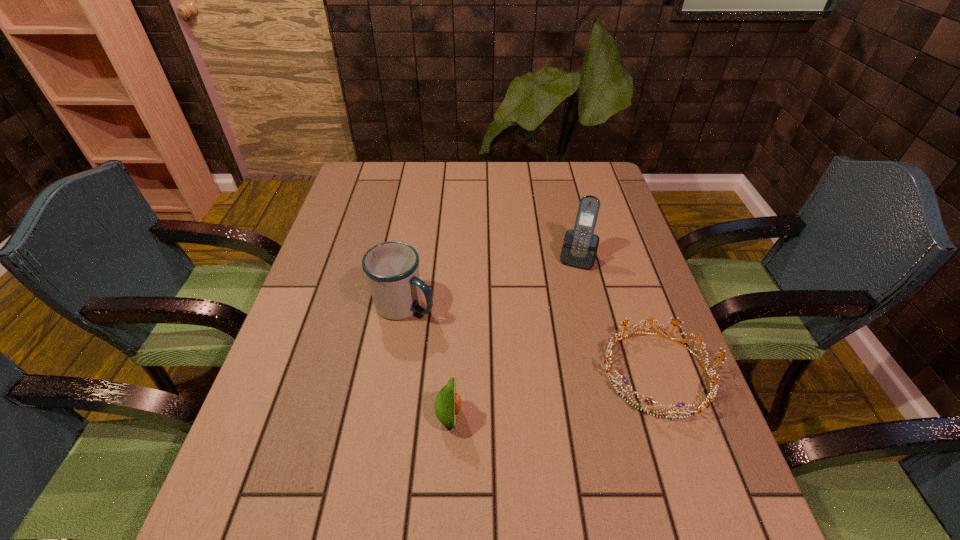
Locate an element on the screen. avocado is located at coordinates (447, 404).

Locate an element on the screen. This screenshot has width=960, height=540. the second object from left to right is located at coordinates (447, 404).

Locate an element on the screen. The height and width of the screenshot is (540, 960). the shortest object is located at coordinates (712, 392).

Locate an element on the screen. Image resolution: width=960 pixels, height=540 pixels. the leftmost object is located at coordinates (392, 268).

Locate an element on the screen. the third shortest object is located at coordinates (392, 268).

The height and width of the screenshot is (540, 960). What are the coordinates of `cellular telephone` in the screenshot? It's located at (580, 245).

The height and width of the screenshot is (540, 960). Identify the location of vacant space situated 0.140m on the cut side of the third object from right to left. (531, 417).

This screenshot has width=960, height=540. Find the location of `free spot located on the handle side of the third shortest object`. free spot located on the handle side of the third shortest object is located at coordinates pyautogui.click(x=538, y=367).

The height and width of the screenshot is (540, 960). Identify the location of vacant space located 0.310m on the handle side of the third shortest object. (545, 370).

Image resolution: width=960 pixels, height=540 pixels. Identify the location of free space located 0.160m on the handle side of the third shortest object. (487, 342).